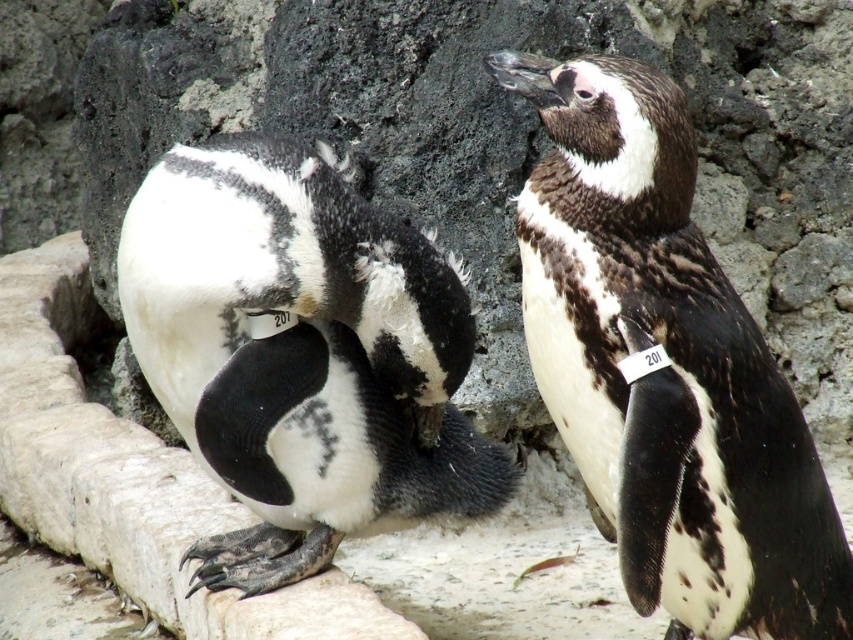
Who is shorter, black and white feathers at center or white matte penguin at center?

white matte penguin at center

Is point (799, 593) positioned before point (285, 449)?

Yes, point (799, 593) is closer to viewer.

Locate an element on the screen. The height and width of the screenshot is (640, 853). black and white feathers at center is located at coordinates (665, 368).